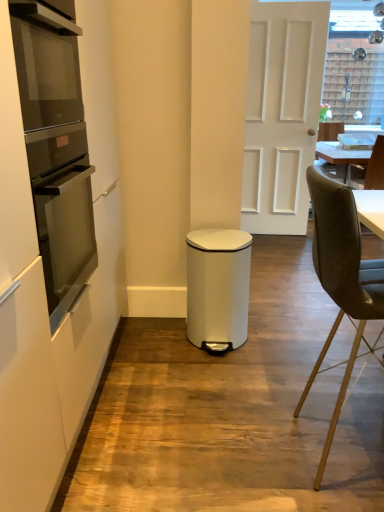
The height and width of the screenshot is (512, 384). Find the location of `vacant space underneath leather-like brown chair at right, positioned as the second chair in back-to-front order (from a real-world perspective)`. vacant space underneath leather-like brown chair at right, positioned as the second chair in back-to-front order (from a real-world perspective) is located at coordinates (340, 444).